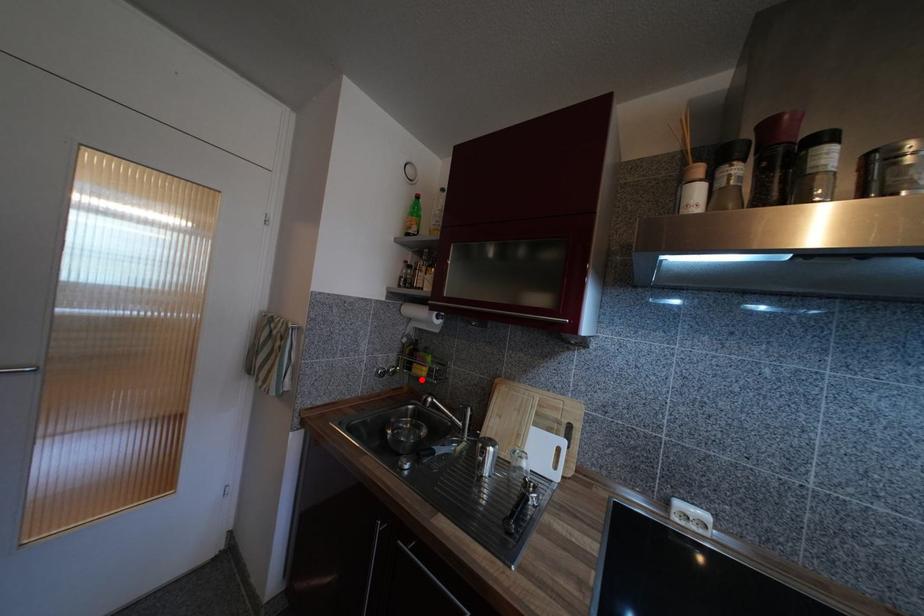
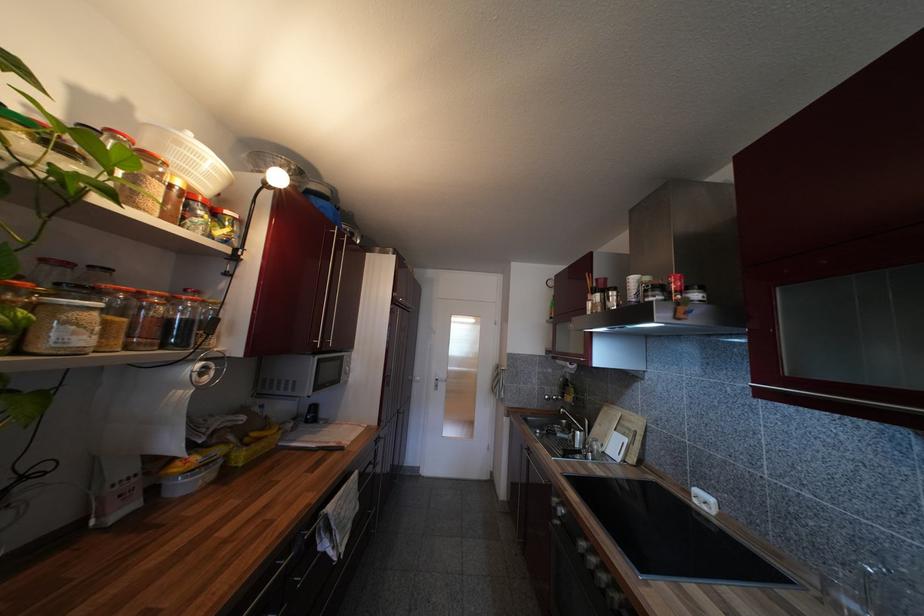
Where in the second image is the point corresponding to the highlighted location from the first image?

(570, 405)